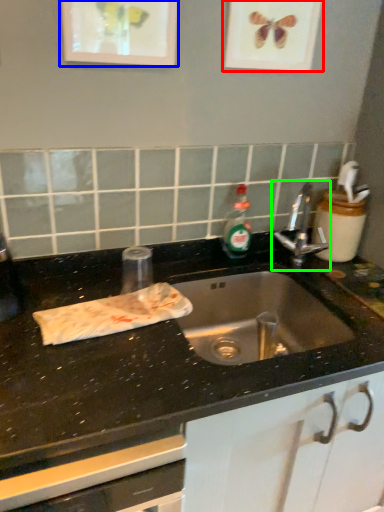
Question: Which object is the farthest from picture frame (highlighted by a red box)? Choose among these: picture frame (highlighted by a blue box) or tap (highlighted by a green box).

Choices:
 (A) picture frame
 (B) tap

Answer: (B)